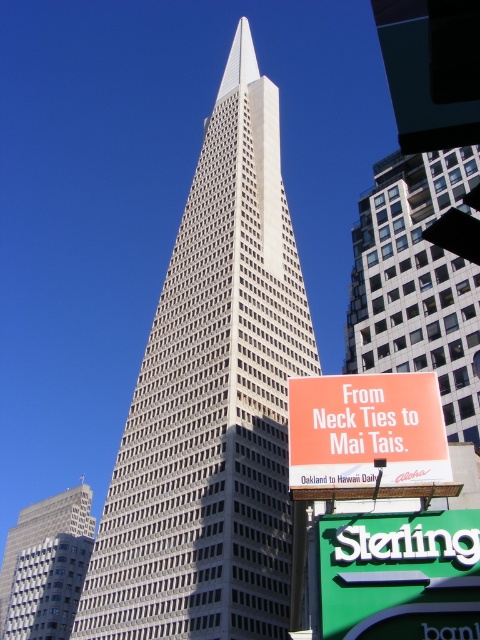
You are standing at the green plastic sign at lower right and want to reach the gray concrete skyscraper at center. If you walk directly towards the skyscraper, how far will you have to walk in feet?

The green plastic sign at lower right and the gray concrete skyscraper at center are 471.89 feet apart from each other, so you will have to walk 471.89 feet to reach the skyscraper.

You are standing in front of the Transamerica Pyramid and want to locate the green plastic sign at lower right. According to the coordinates provided, where exactly should you look to find it?

The green plastic sign at lower right is located at point (399, 576).

You are standing at the base of the Transamerica Pyramid and want to take a photo of the green plastic sign at lower right. If your camera can focus on objects up to 100 feet away, will you be able to capture a clear image of the sign?

The green plastic sign at lower right is 76.56 feet away from the camera, which is within the camera focus range of up to 100 feet. Therefore, you can capture a clear image of the sign.